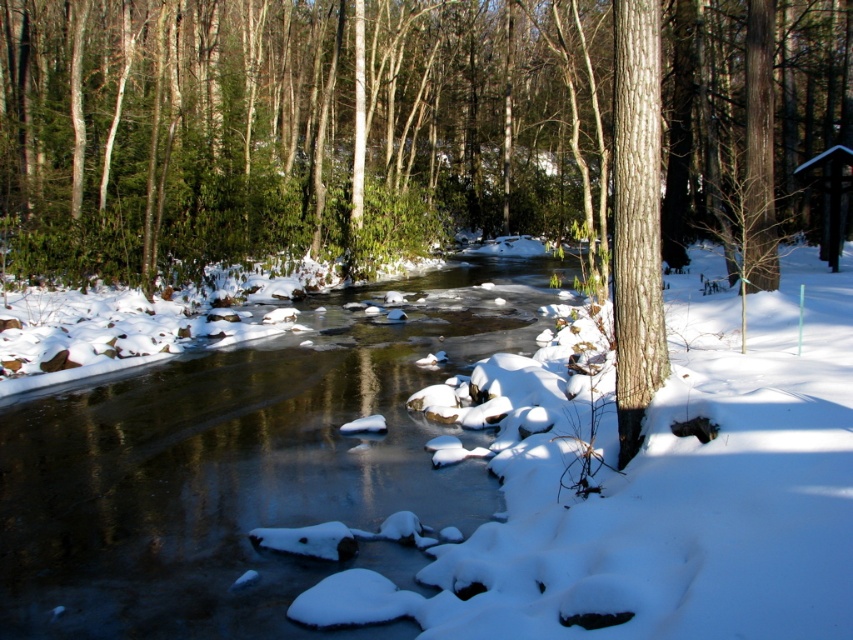
Looking at this image, you are an explorer trying to cross the stream. You see the clear ice stream at center and the smooth brown bark at right. Which one is shorter in height?

The clear ice stream at center has a lesser height compared to the smooth brown bark at right, so the clear ice stream at center is shorter in height.

You are standing at the edge of the forest and want to cross the stream. The clear ice stream at center is the only path available. Based on the coordinates provided, can you safely walk across it?

The clear ice stream at center is located at point coordinates, but the description does not provide information about its thickness or safety for walking. Therefore, it is not possible to determine if it is safe to cross based on the given information.

You are an explorer trying to cross the stream. You see the clear ice stream at center and the smooth brown bark at right. Which object is closer to your left side when facing the stream?

The clear ice stream at center is positioned on the left side of smooth brown bark at right, so when facing the stream, the clear ice stream at center would be closer to your left side.